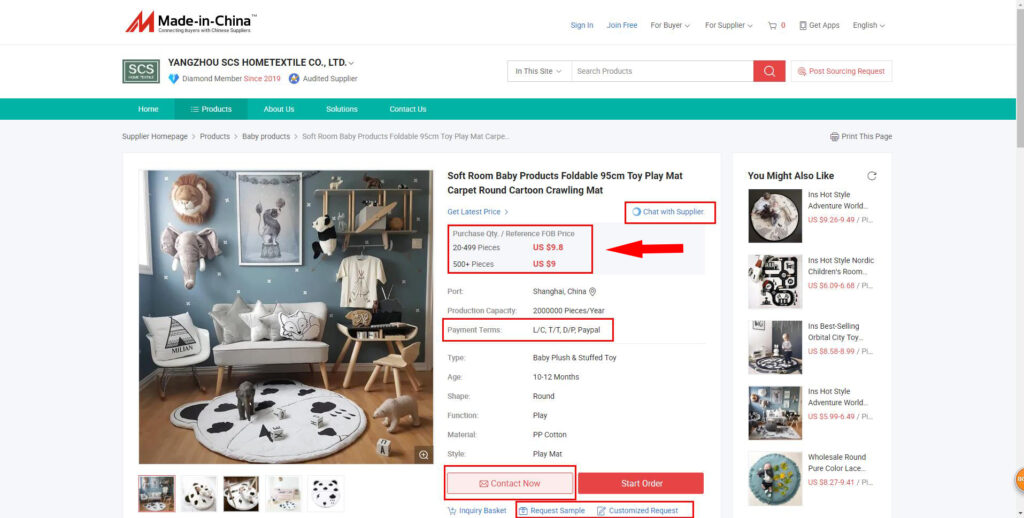
Where is `white chair`? white chair is located at coordinates tap(185, 359).